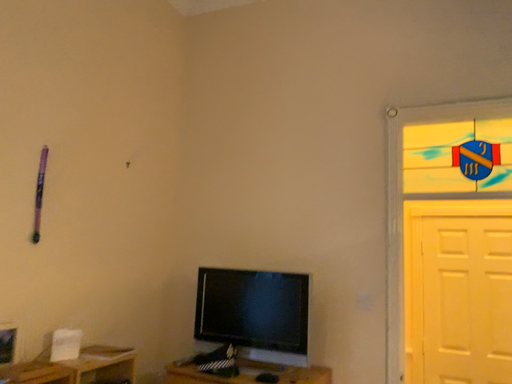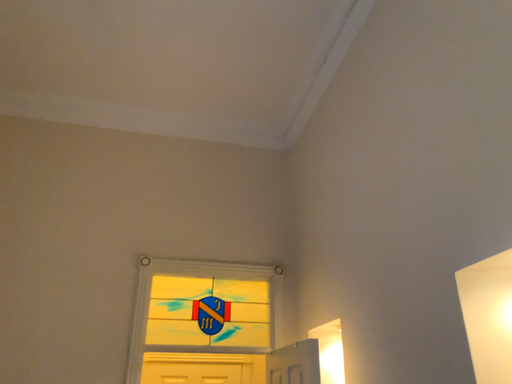
Question: How did the camera likely rotate when shooting the video?

Choices:
 (A) rotated right
 (B) rotated left

Answer: (A)